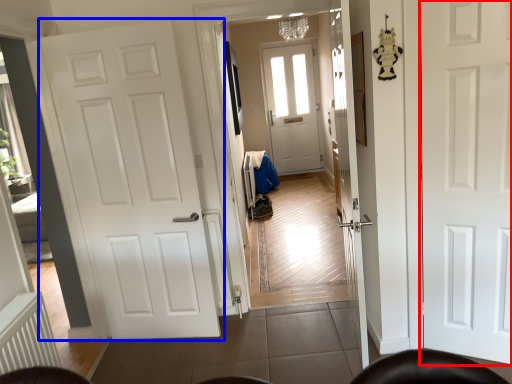
Question: Which object is further to the camera taking this photo, door (highlighted by a red box) or door (highlighted by a blue box)?

Choices:
 (A) door
 (B) door

Answer: (B)